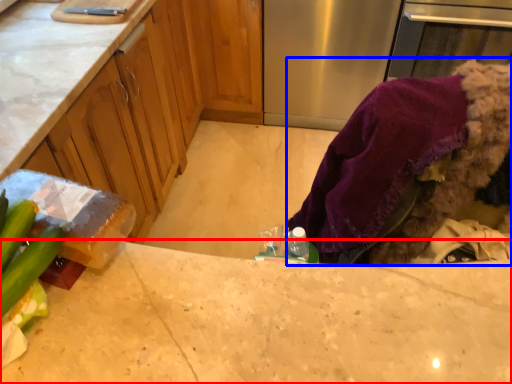
Question: Which object is closer to the camera taking this photo, countertop (highlighted by a red box) or clothing (highlighted by a blue box)?

Choices:
 (A) countertop
 (B) clothing

Answer: (A)